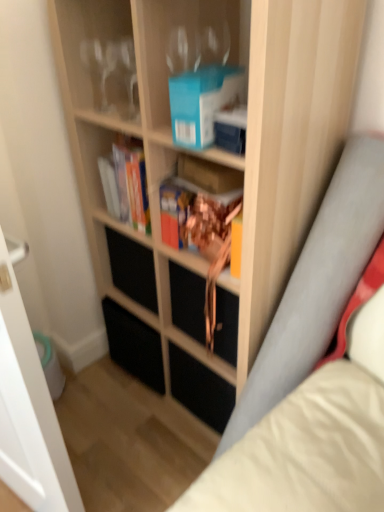
Question: Should I look upward or downward to see blue matte paperback book at upper center?

Choices:
 (A) down
 (B) up

Answer: (B)

Question: Does blue matte paperback book at upper center come in front of transparent glass door at left?

Choices:
 (A) yes
 (B) no

Answer: (B)

Question: Is blue matte paperback book at upper center next to transparent glass door at left and touching it?

Choices:
 (A) no
 (B) yes

Answer: (A)

Question: From the image's perspective, is blue matte paperback book at upper center below transparent glass door at left?

Choices:
 (A) yes
 (B) no

Answer: (B)

Question: Considering the relative sizes of blue matte paperback book at upper center and transparent glass door at left in the image provided, is blue matte paperback book at upper center shorter than transparent glass door at left?

Choices:
 (A) no
 (B) yes

Answer: (B)

Question: Is blue matte paperback book at upper center wider than transparent glass door at left?

Choices:
 (A) no
 (B) yes

Answer: (B)

Question: From the image's perspective, is blue matte paperback book at upper center over transparent glass door at left?

Choices:
 (A) yes
 (B) no

Answer: (A)

Question: Does transparent glass door at left turn towards black matte drawer at center?

Choices:
 (A) yes
 (B) no

Answer: (B)

Question: Considering the relative sizes of transparent glass door at left and black matte drawer at center in the image provided, is transparent glass door at left smaller than black matte drawer at center?

Choices:
 (A) yes
 (B) no

Answer: (B)

Question: Would you consider transparent glass door at left to be distant from black matte drawer at center?

Choices:
 (A) yes
 (B) no

Answer: (B)

Question: Considering the relative sizes of transparent glass door at left and black matte drawer at center in the image provided, is transparent glass door at left shorter than black matte drawer at center?

Choices:
 (A) yes
 (B) no

Answer: (B)

Question: From a real-world perspective, is transparent glass door at left located higher than black matte drawer at center?

Choices:
 (A) no
 (B) yes

Answer: (B)

Question: Does transparent glass door at left have a larger size compared to black matte drawer at center?

Choices:
 (A) no
 (B) yes

Answer: (B)

Question: Would you say black matte drawer at center is a long distance from hardcover book at center, the second book from the right?

Choices:
 (A) no
 (B) yes

Answer: (A)